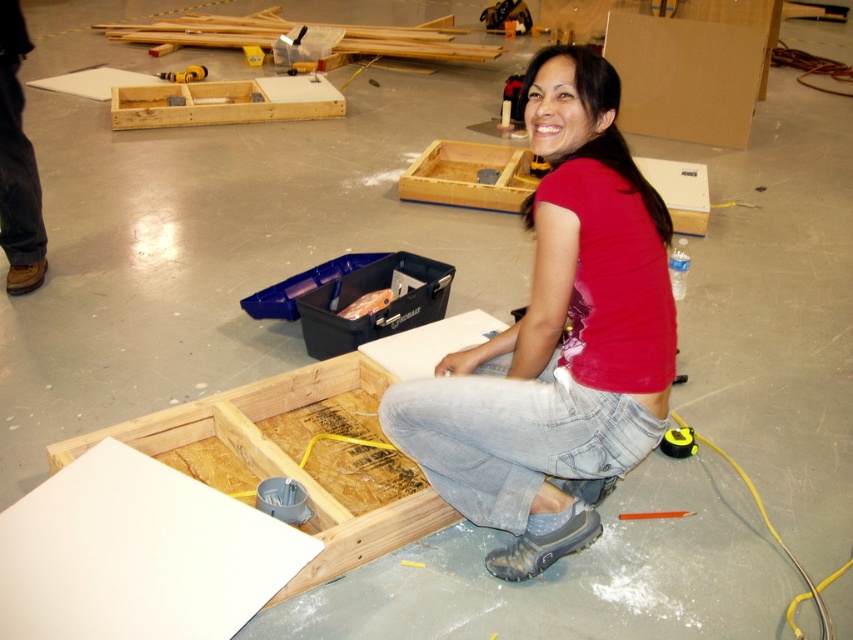
Question: Which of the following is the closest to the observer?

Choices:
 (A) (338, 346)
 (B) (517, 353)
 (C) (184, 70)

Answer: (B)

Question: Is black plastic toolbox at center wider than wooden planks at upper center?

Choices:
 (A) yes
 (B) no

Answer: (B)

Question: Which point is farther to the camera?

Choices:
 (A) wooden planks at upper center
 (B) red matte shirt at center
 (C) woodenmaterial/texture at upper center

Answer: (A)

Question: Is wooden planks at upper center behind yellow plastic tape measure at center?

Choices:
 (A) yes
 (B) no

Answer: (A)

Question: Which object is farther from the camera taking this photo?

Choices:
 (A) wooden planks at upper center
 (B) yellow plastic tape measure at center
 (C) red matte shirt at center
 (D) black plastic toolbox at center

Answer: (A)

Question: From the image, what is the correct spatial relationship of woodenmaterial/texture at upper center in relation to yellow plastic tape measure at center?

Choices:
 (A) above
 (B) below

Answer: (B)